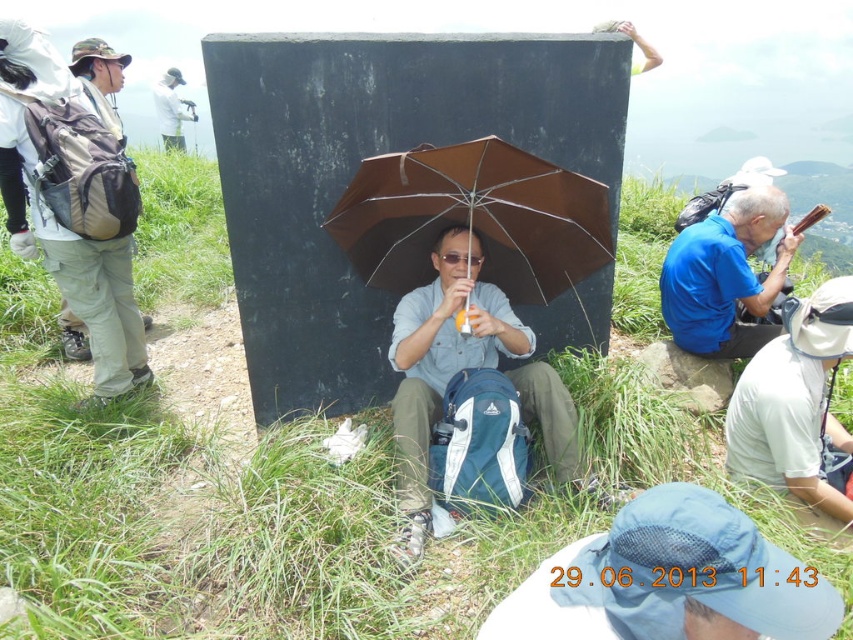
You are a photographer carrying a large tripod that requires 10 meters of space to set up. You see the brown matte umbrella at center and the white fabric camera at upper left in the scene. Is there enough space between them to set up your tripod?

The distance between the brown matte umbrella at center and the white fabric camera at upper left is 8.69 meters, which is less than the required 10 meters. Therefore, there isn not enough space to set up the tripod between them.

In the scene shown: You are a photographer trying to capture a group photo of the blue fabric shirt at center and the white fabric camera at upper left. Which object is wider so that you can adjust your camera angle accordingly?

The blue fabric shirt at center is wider than the white fabric camera at upper left, so you should adjust your camera angle to accommodate its larger width.

You are a drone operator trying to locate a hiker wearing a blue fabric shirt at center. According to the coordinates provided, where would you direct the drone to find the hiker?

The blue fabric shirt at center is located at coordinates point (724, 275).